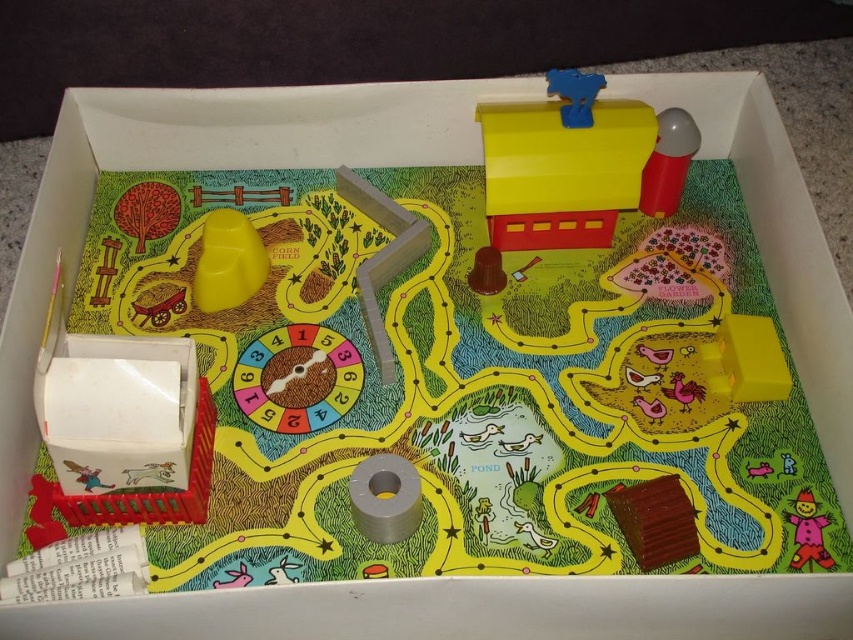
Question: Does matte plastic mailbox at upper right appear under matte pink scarecrow at lower right?

Choices:
 (A) no
 (B) yes

Answer: (A)

Question: Which of the following is the farthest from the observer?

Choices:
 (A) (589, 136)
 (B) (811, 493)

Answer: (A)

Question: Which point appears farthest from the camera in this image?

Choices:
 (A) (498, 141)
 (B) (801, 544)

Answer: (A)

Question: Does matte plastic mailbox at upper right appear on the left side of matte pink scarecrow at lower right?

Choices:
 (A) no
 (B) yes

Answer: (B)

Question: Does matte plastic mailbox at upper right come behind matte pink scarecrow at lower right?

Choices:
 (A) yes
 (B) no

Answer: (A)